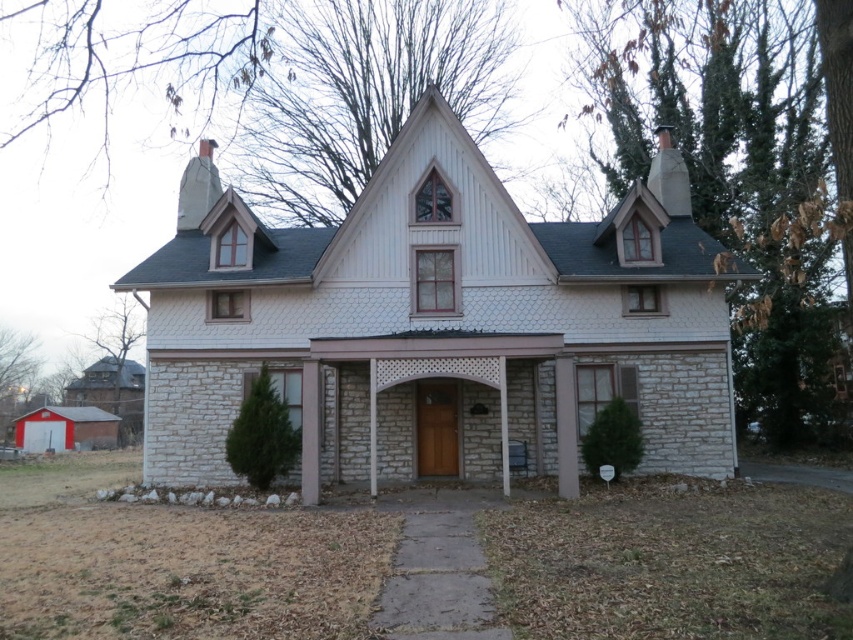
Question: Is white stone pillar at right thinner than white stone pillar at center?

Choices:
 (A) yes
 (B) no

Answer: (A)

Question: Which object appears farthest from the camera in this image?

Choices:
 (A) white stone pillar at right
 (B) white stone pillar at center

Answer: (A)

Question: Is white stone pillar at right above white stone pillar at center?

Choices:
 (A) no
 (B) yes

Answer: (B)

Question: Which point appears farthest from the camera in this image?

Choices:
 (A) (556, 420)
 (B) (305, 381)

Answer: (A)

Question: In this image, where is white stone pillar at right located relative to white stone pillar at center?

Choices:
 (A) below
 (B) above

Answer: (B)